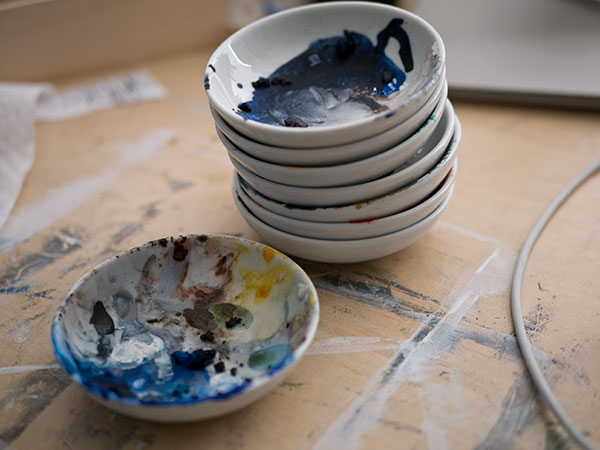
At what (x,y) coordinates should I click in order to perform the action: click on edges of dishes in stack. Please return your answer as a coordinate pair (x, y). Image resolution: width=600 pixels, height=450 pixels. Looking at the image, I should click on (435, 80), (434, 97), (438, 115), (443, 144), (445, 161), (442, 190), (437, 211).